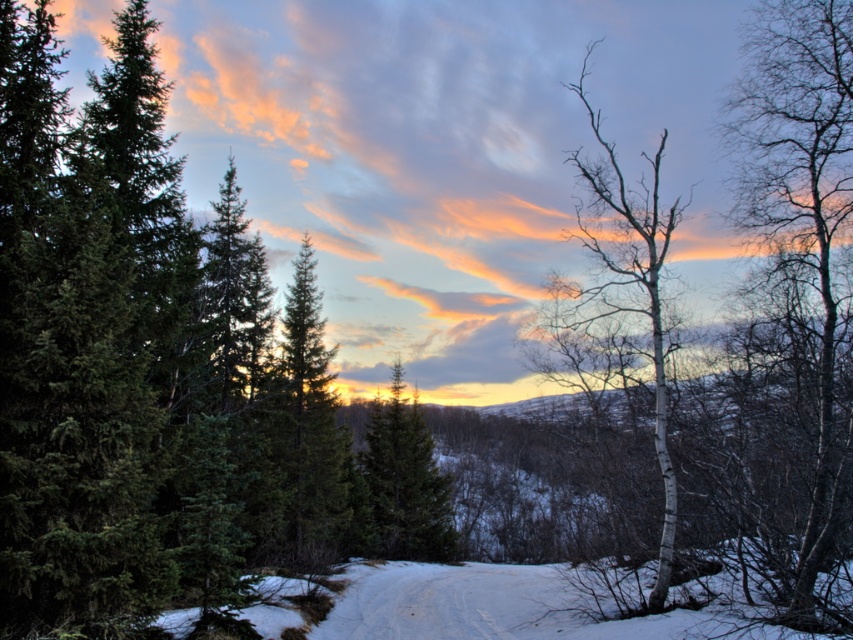
Does point (804, 88) lie behind point (428, 481)?

No, it is not.

Between bare wood tree at right and green matte evergreen tree at center, which one appears on the right side from the viewer's perspective?

bare wood tree at right is more to the right.

Locate an element on the screen. bare wood tree at right is located at coordinates (805, 227).

Is white bark tree at right positioned in front of green matte tree at center?

Yes, it is.

Between point (590, 172) and point (292, 422), which one is positioned in front?

Point (292, 422) is in front.

Find the location of a particular element. This screenshot has height=640, width=853. white bark tree at right is located at coordinates (621, 296).

Is point (334, 472) positioned behind point (358, 465)?

No, (334, 472) is in front of (358, 465).

Does green matte tree at center have a smaller size compared to green matte evergreen tree at center?

→ Yes.

Measure the distance between green matte tree at center and camera.

They are 25.13 meters apart.

Find the location of `green matte tree at center`. green matte tree at center is located at coordinates (306, 435).